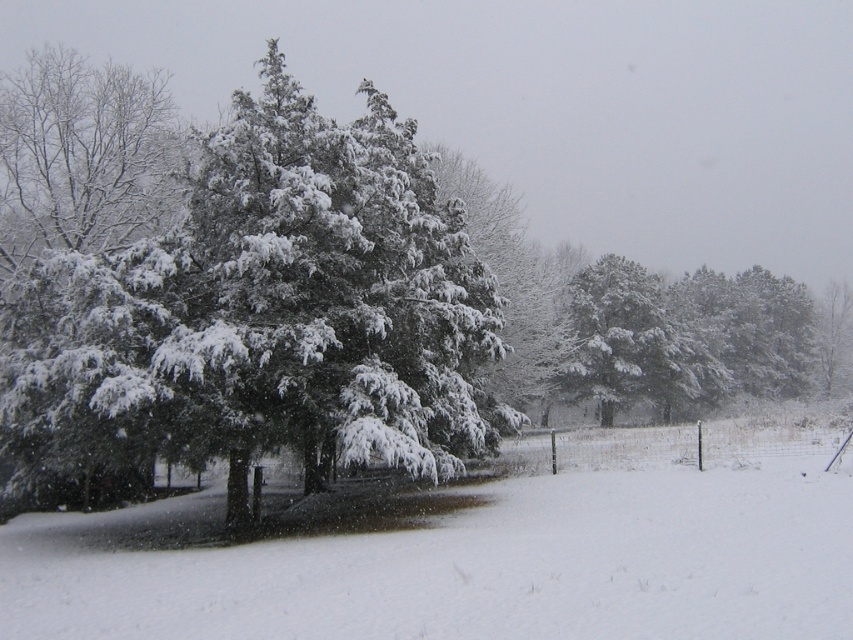
Based on the scene description, what are the coordinates of the green matte tree at center?

The green matte tree at center is located at coordinates point (259,321).